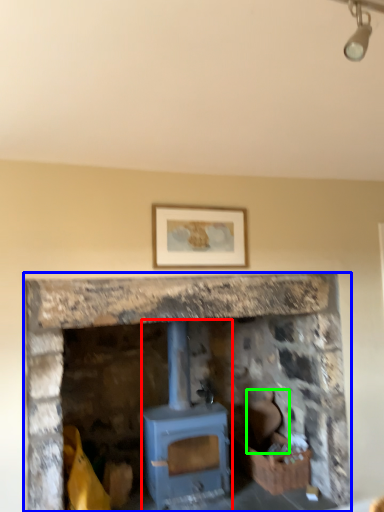
Question: Estimate the real-world distances between objects in this image. Which object is closer to wood burning stove (highlighted by a red box), fireplace (highlighted by a blue box) or chair (highlighted by a green box)?

Choices:
 (A) fireplace
 (B) chair

Answer: (A)